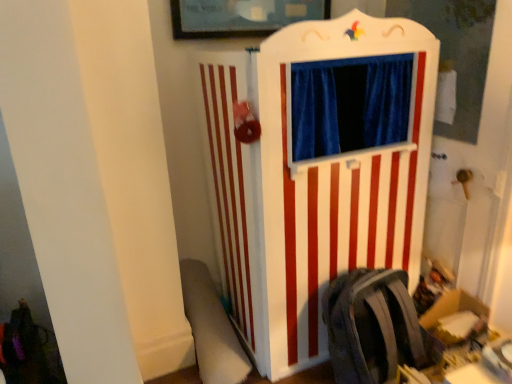
This screenshot has width=512, height=384. What do you see at coordinates (374, 327) in the screenshot?
I see `matte gray backpack at lower right` at bounding box center [374, 327].

Identify the location of white plush swivel chair at lower left. (211, 328).

Is white plush swivel chair at lower left touching matte gray backpack at lower right?

No, white plush swivel chair at lower left is not making contact with matte gray backpack at lower right.

From the image's perspective, is white plush swivel chair at lower left above matte gray backpack at lower right?

No, from the image's perspective, white plush swivel chair at lower left is not on top of matte gray backpack at lower right.

Who is shorter, white plush swivel chair at lower left or matte gray backpack at lower right?

white plush swivel chair at lower left is shorter.

Considering the positions of objects white wood puppet theater at center and matte gray backpack at lower right in the image provided, who is behind, white wood puppet theater at center or matte gray backpack at lower right?

matte gray backpack at lower right.

Considering the sizes of objects white wood puppet theater at center and matte gray backpack at lower right in the image provided, who is smaller, white wood puppet theater at center or matte gray backpack at lower right?

With smaller size is matte gray backpack at lower right.

Locate an element on the screen. The width and height of the screenshot is (512, 384). folding chair located on the right of white wood puppet theater at center is located at coordinates (374, 327).

Consider the image. How far apart are white wood puppet theater at center and matte gray backpack at lower right?

The distance of white wood puppet theater at center from matte gray backpack at lower right is 15.07 inches.

Considering the sizes of objects matte gray backpack at lower right and white wood puppet theater at center in the image provided, who is wider, matte gray backpack at lower right or white wood puppet theater at center?

white wood puppet theater at center is wider.

Which object is further away from the camera, matte gray backpack at lower right or white wood puppet theater at center?

matte gray backpack at lower right is further away from the camera.

Considering the positions of point (403, 311) and point (341, 206), is point (403, 311) closer or farther from the camera than point (341, 206)?

Point (403, 311) is closer to the camera than point (341, 206).

Is white wood puppet theater at center completely or partially inside matte gray backpack at lower right?

That's incorrect, white wood puppet theater at center is not inside matte gray backpack at lower right.

Is point (410, 356) in front of point (198, 281)?

Yes, it is.

What are the coordinates of `folding chair that appears on the right of white plush swivel chair at lower left` in the screenshot? It's located at (374, 327).

Measure the distance between matte gray backpack at lower right and white plush swivel chair at lower left.

The distance of matte gray backpack at lower right from white plush swivel chair at lower left is 22.28 inches.

Consider the image. Could you tell me if matte gray backpack at lower right is facing white plush swivel chair at lower left?

No, matte gray backpack at lower right is not aimed at white plush swivel chair at lower left.

Which object is positioned more to the left, white plush swivel chair at lower left or white wood puppet theater at center?

white plush swivel chair at lower left.

What's the angular difference between white plush swivel chair at lower left and white wood puppet theater at center's facing directions?

0.000133 degrees.

How far apart are white plush swivel chair at lower left and white wood puppet theater at center?

white plush swivel chair at lower left is 21.40 inches away from white wood puppet theater at center.

Is white wood puppet theater at center located within white plush swivel chair at lower left?

No.

Does point (318, 164) come closer to viewer compared to point (234, 339)?

Yes, it is in front of point (234, 339).

Is white wood puppet theater at center oriented away from white plush swivel chair at lower left?

No, white wood puppet theater at center is not facing away from white plush swivel chair at lower left.

Would you consider white wood puppet theater at center to be distant from white plush swivel chair at lower left?

No, there isn't a large distance between white wood puppet theater at center and white plush swivel chair at lower left.

Which is in front, white wood puppet theater at center or white plush swivel chair at lower left?

white wood puppet theater at center is in front.

This screenshot has width=512, height=384. What are the coordinates of `swivel chair below the matte gray backpack at lower right (from a real-world perspective)` in the screenshot? It's located at [x=211, y=328].

Find the location of a particular element. The height and width of the screenshot is (384, 512). folding chair behind the white wood puppet theater at center is located at coordinates (374, 327).

Considering their positions, is white wood puppet theater at center positioned closer to white plush swivel chair at lower left than matte gray backpack at lower right?

Based on the image, white wood puppet theater at center appears to be nearer to white plush swivel chair at lower left.

Looking at the image, which one is located further to white wood puppet theater at center, white plush swivel chair at lower left or matte gray backpack at lower right?

white plush swivel chair at lower left lies further to white wood puppet theater at center than the other object.

When comparing their distances from white plush swivel chair at lower left, does matte gray backpack at lower right or white wood puppet theater at center seem closer?

white wood puppet theater at center is closer to white plush swivel chair at lower left.

Estimate the real-world distances between objects in this image. Which object is closer to white wood puppet theater at center, matte gray backpack at lower right or white plush swivel chair at lower left?

matte gray backpack at lower right lies closer to white wood puppet theater at center than the other object.

Based on their spatial positions, is white plush swivel chair at lower left or white wood puppet theater at center further from matte gray backpack at lower right?

The object further to matte gray backpack at lower right is white plush swivel chair at lower left.

Which object lies further to the anchor point matte gray backpack at lower right, white wood puppet theater at center or white plush swivel chair at lower left?

white plush swivel chair at lower left.

Find the location of a particular element. The width and height of the screenshot is (512, 384). furniture between white plush swivel chair at lower left and matte gray backpack at lower right is located at coordinates (312, 182).